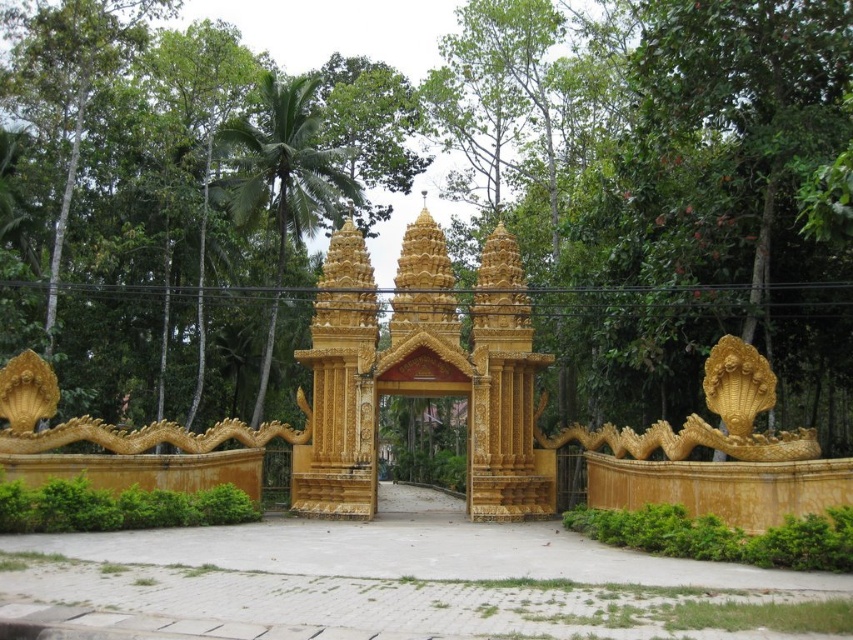
From the picture: You are a photographer planning to take a picture of the gold ornate gate at center and the green leafy tree at upper left. Based on their sizes in the scene, which object should appear larger in your photo?

The green leafy tree at upper left is much taller than the gold ornate gate at center, so it should appear larger in the photo.

You are an architect examining the temple gate structure. You observe the golden polished gate at center and the gold ornate gate at center. Which of these two gates is taller?

The golden polished gate at center is taller than the gold ornate gate at center according to the description.